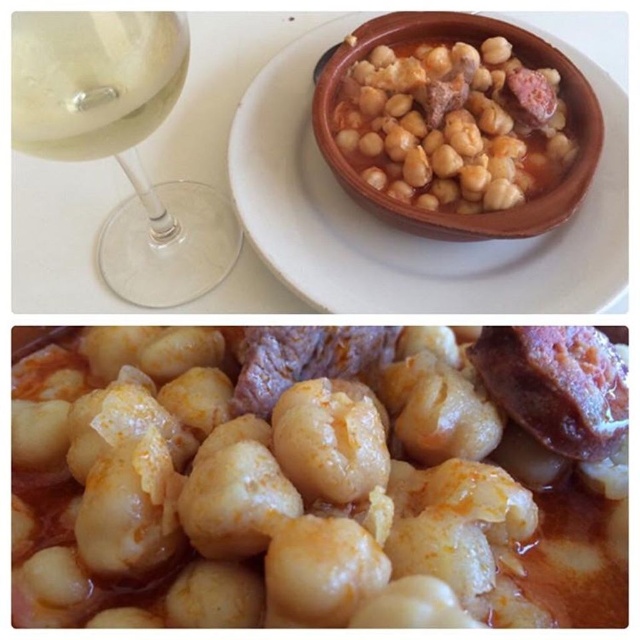
Between clear glass wine at top left and terracotta bowl at upper center, which one has more height?

terracotta bowl at upper center

Does clear glass wine at top left have a greater height compared to terracotta bowl at upper center?

Incorrect, clear glass wine at top left's height is not larger of terracotta bowl at upper center's.

Which is in front, point (54, 138) or point (380, 195)?

Positioned in front is point (54, 138).

You are a GUI agent. You are given a task and a screenshot of the screen. Output one action in this format:
    pyautogui.click(x=<x>, y=<y>)
    Task: Click on the clear glass wine at top left
    The width and height of the screenshot is (640, 640).
    Given the screenshot: What is the action you would take?
    pyautogui.click(x=93, y=80)

Based on the photo, between transparent glass wine at upper left and clear glass wine at top left, which one has more height?

With more height is transparent glass wine at upper left.

Who is shorter, transparent glass wine at upper left or clear glass wine at top left?

clear glass wine at top left is shorter.

This screenshot has height=640, width=640. I want to click on transparent glass wine at upper left, so click(122, 141).

The width and height of the screenshot is (640, 640). Identify the location of transparent glass wine at upper left. (122, 141).

How distant is glossy white gnocchi at center from transparent glass wine at upper left?

They are 9.34 inches apart.

Is point (29, 531) farther from viewer compared to point (138, 205)?

No, it is not.

Locate an element on the screen. Image resolution: width=640 pixels, height=640 pixels. glossy white gnocchi at center is located at coordinates (308, 481).